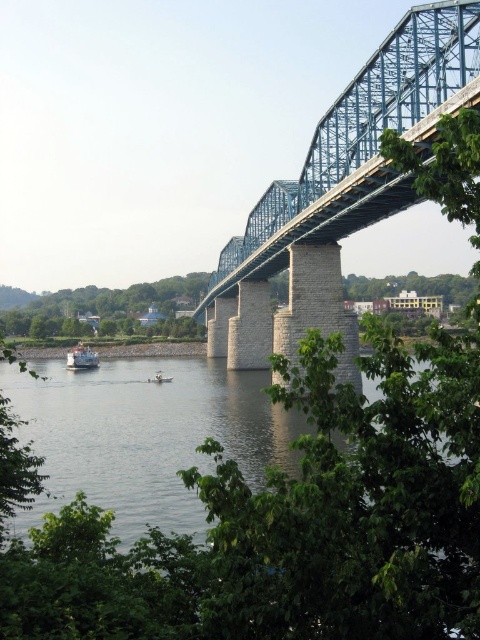
Question: Is clear water at center below blue metallic bridge at upper right?

Choices:
 (A) no
 (B) yes

Answer: (B)

Question: Is blue metallic bridge at upper right above metallic gray boat at lower left?

Choices:
 (A) no
 (B) yes

Answer: (B)

Question: Which point is closer to the camera taking this photo?

Choices:
 (A) (402, 49)
 (B) (152, 378)
 (C) (96, 362)

Answer: (A)

Question: Which object is the farthest from the metallic gray boat at lower left?

Choices:
 (A) blue metallic bridge at upper right
 (B) clear water at center

Answer: (A)

Question: Among these points, which one is nearest to the camera?

Choices:
 (A) (94, 483)
 (B) (441, 102)
 (C) (157, 378)

Answer: (B)

Question: Does clear water at center lie behind metallic gray boat at lower left?

Choices:
 (A) no
 (B) yes

Answer: (A)